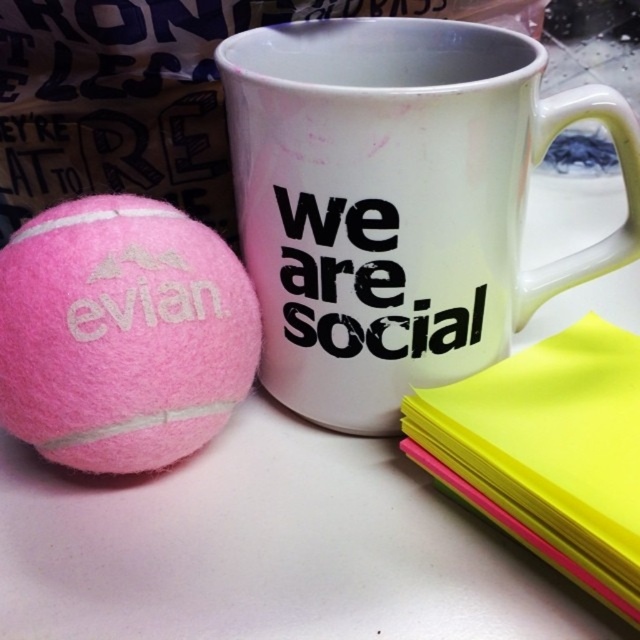
Question: Is white glossy mug at center thinner than yellow paper at right?

Choices:
 (A) no
 (B) yes

Answer: (A)

Question: Which of the following is the farthest from the observer?

Choices:
 (A) (250, 232)
 (B) (602, 502)

Answer: (A)

Question: Is white glossy mug at center positioned before yellow paper at right?

Choices:
 (A) yes
 (B) no

Answer: (B)

Question: Which of the following is the closest to the observer?

Choices:
 (A) (285, 58)
 (B) (573, 352)

Answer: (B)

Question: Which point is farther to the camera?

Choices:
 (A) click(x=298, y=246)
 (B) click(x=634, y=618)

Answer: (A)

Question: Where is white glossy mug at center located in relation to yellow paper at right in the image?

Choices:
 (A) below
 (B) above

Answer: (B)